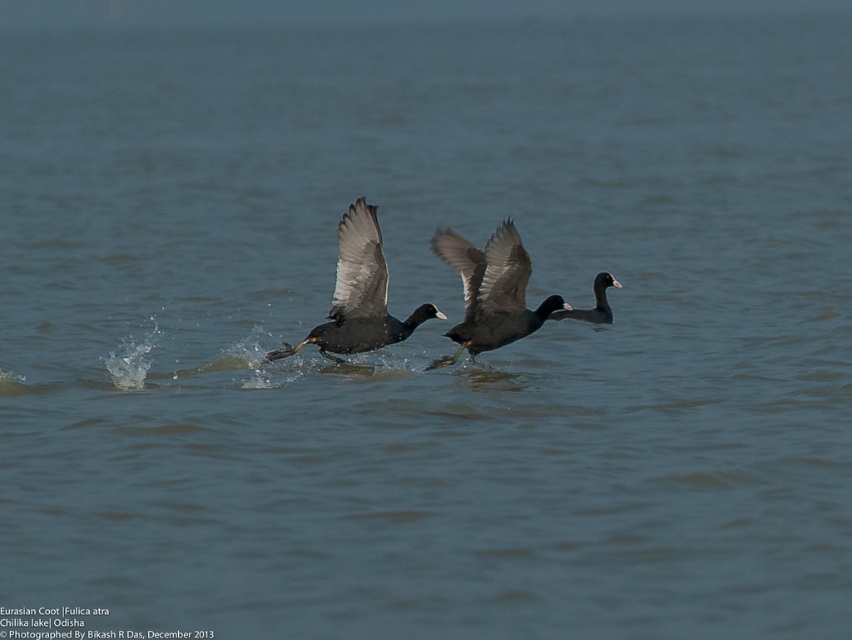
You are observing two points in the image of the Eurasian Coots. The first point is at coordinates point [360,240] and the second is at point [602,278]. Which of these points is nearer to the viewer?

Point [360,240] is closer to the camera than point [602,278].

You are observing the scene of three Eurasian Coots. You notice the dark gray matte eurasian coot at center and the dark gray feathers at center. Which object is closer to the water surface?

The dark gray matte eurasian coot at center is positioned under the dark gray feathers at center, meaning the dark gray feathers at center are closer to the water surface.